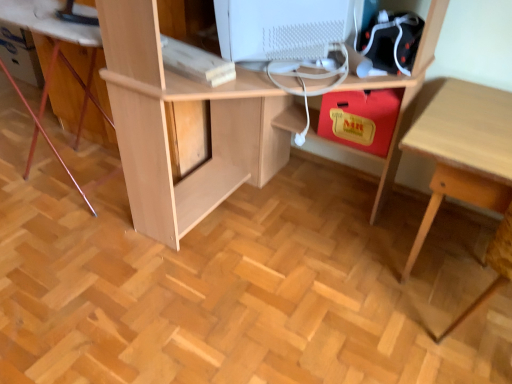
The width and height of the screenshot is (512, 384). I want to click on vacant region under light wood table at lower right (from a real-world perspective), so click(x=432, y=255).